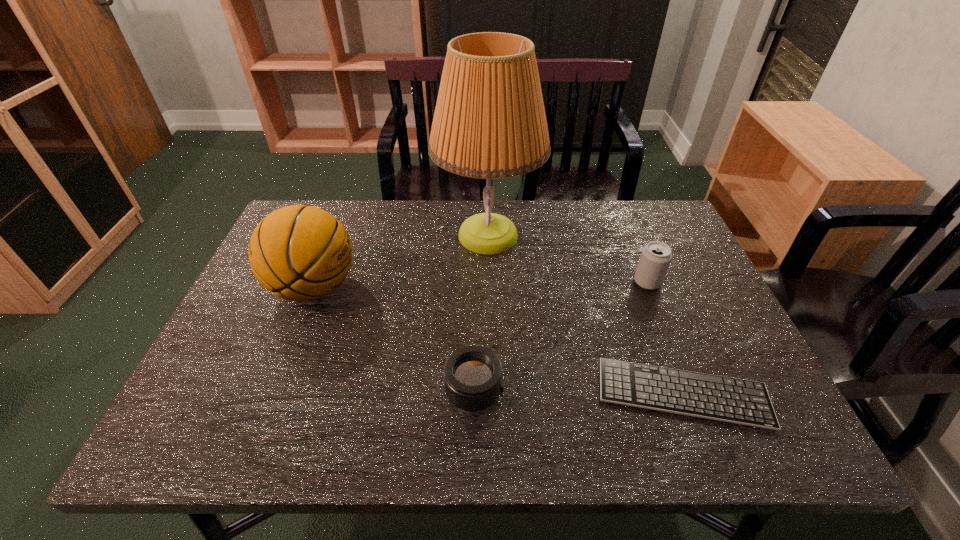
The width and height of the screenshot is (960, 540). Find the location of `vacant space at the far edge`. vacant space at the far edge is located at coordinates (354, 227).

Where is `free space at the near edge of the desktop`? This screenshot has width=960, height=540. free space at the near edge of the desktop is located at coordinates (371, 410).

In the image, there is a desktop. Where is `vacant region at the right edge`? The height and width of the screenshot is (540, 960). vacant region at the right edge is located at coordinates (719, 312).

The image size is (960, 540). What are the coordinates of `free space at the far left corner` in the screenshot? It's located at (314, 206).

The width and height of the screenshot is (960, 540). I want to click on vacant region at the near left corner of the desktop, so click(x=189, y=408).

Identify the location of vacant space at the far right corner of the desktop. The height and width of the screenshot is (540, 960). 638,247.

Locate an element on the screen. The height and width of the screenshot is (540, 960). vacant space at the near right corner is located at coordinates (721, 444).

Where is `vacant area that lies between the telephoto lens and the basketball`? vacant area that lies between the telephoto lens and the basketball is located at coordinates (395, 339).

Find the location of `vacant point located between the computer keyboard and the basketball`. vacant point located between the computer keyboard and the basketball is located at coordinates (499, 341).

Locate an element on the screen. The height and width of the screenshot is (540, 960). free space between the computer keyboard and the second tallest object is located at coordinates (499, 341).